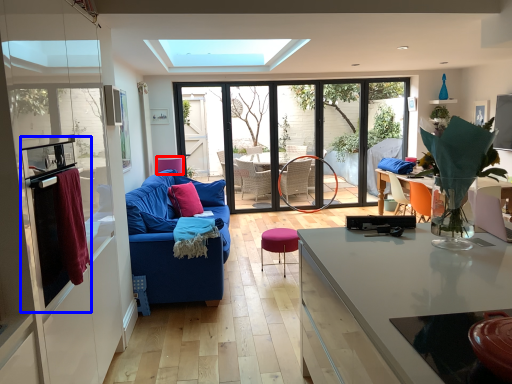
Question: Among these objects, which one is nearest to the camera, armchair (highlighted by a red box) or appliance (highlighted by a blue box)?

Choices:
 (A) armchair
 (B) appliance

Answer: (B)